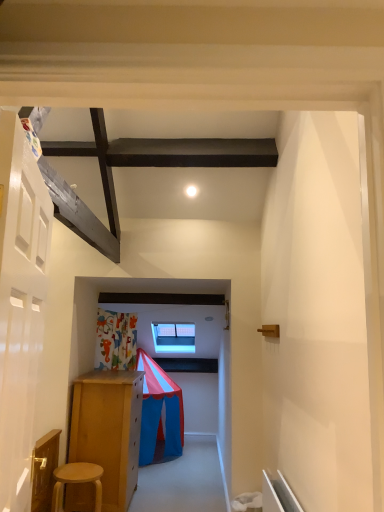
Question: Can you confirm if light brown wooden stool at lower left is positioned to the left of white glossy light at upper center?

Choices:
 (A) yes
 (B) no

Answer: (A)

Question: From a real-world perspective, is light brown wooden stool at lower left below white glossy light at upper center?

Choices:
 (A) no
 (B) yes

Answer: (B)

Question: Considering the relative positions of light brown wooden stool at lower left and white glossy light at upper center in the image provided, is light brown wooden stool at lower left to the right of white glossy light at upper center from the viewer's perspective?

Choices:
 (A) no
 (B) yes

Answer: (A)

Question: Considering the relative sizes of light brown wooden stool at lower left and white glossy light at upper center in the image provided, is light brown wooden stool at lower left shorter than white glossy light at upper center?

Choices:
 (A) no
 (B) yes

Answer: (A)

Question: Is the surface of light brown wooden stool at lower left in direct contact with white glossy light at upper center?

Choices:
 (A) yes
 (B) no

Answer: (B)

Question: Considering the relative sizes of light brown wooden stool at lower left and white glossy light at upper center in the image provided, is light brown wooden stool at lower left taller than white glossy light at upper center?

Choices:
 (A) yes
 (B) no

Answer: (A)

Question: Does white glossy door at left turn towards white glossy light at upper center?

Choices:
 (A) no
 (B) yes

Answer: (A)

Question: Is white glossy door at left wider than white glossy light at upper center?

Choices:
 (A) no
 (B) yes

Answer: (A)

Question: From a real-world perspective, is white glossy door at left physically above white glossy light at upper center?

Choices:
 (A) yes
 (B) no

Answer: (B)

Question: From the image's perspective, is white glossy door at left on top of white glossy light at upper center?

Choices:
 (A) yes
 (B) no

Answer: (B)

Question: Considering the relative sizes of white glossy door at left and white glossy light at upper center in the image provided, is white glossy door at left thinner than white glossy light at upper center?

Choices:
 (A) yes
 (B) no

Answer: (A)

Question: Is white glossy door at left positioned beyond the bounds of white glossy light at upper center?

Choices:
 (A) no
 (B) yes

Answer: (B)

Question: From a real-world perspective, is light brown wooden stool at lower left physically above white glossy door at left?

Choices:
 (A) no
 (B) yes

Answer: (A)